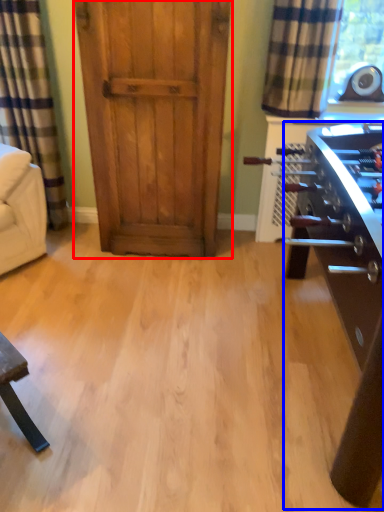
Question: Which of the following is the closest to the observer, door (highlighted by a red box) or table (highlighted by a blue box)?

Choices:
 (A) door
 (B) table

Answer: (B)